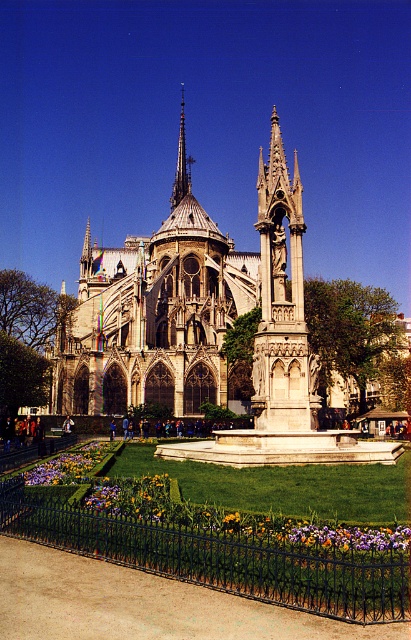
Which is more to the right, stone gothic cathedral at center or polished copper spire at center?

From the viewer's perspective, stone gothic cathedral at center appears more on the right side.

Does stone gothic cathedral at center have a smaller size compared to polished copper spire at center?

No.

The image size is (411, 640). Identify the location of stone gothic cathedral at center. (187, 310).

Which is above, stone gothic cathedral at center or vibrant multicolored petals at lower center?

Positioned higher is stone gothic cathedral at center.

What do you see at coordinates (187, 310) in the screenshot? I see `stone gothic cathedral at center` at bounding box center [187, 310].

What do you see at coordinates (187, 310) in the screenshot? I see `stone gothic cathedral at center` at bounding box center [187, 310].

At what (x,y) coordinates should I click in order to perform the action: click on stone gothic cathedral at center. Please return your answer as a coordinate pair (x, y). Image resolution: width=411 pixels, height=640 pixels. Looking at the image, I should click on (187, 310).

Between point (30, 483) and point (182, 150), which one is positioned behind?

Positioned behind is point (182, 150).

From the picture: Is vibrant multicolored petals at lower center bigger than polished copper spire at center?

Actually, vibrant multicolored petals at lower center might be smaller than polished copper spire at center.

Who is more distant from viewer, (99, 448) or (171, 200)?

Positioned behind is point (171, 200).

I want to click on vibrant multicolored petals at lower center, so click(x=69, y=465).